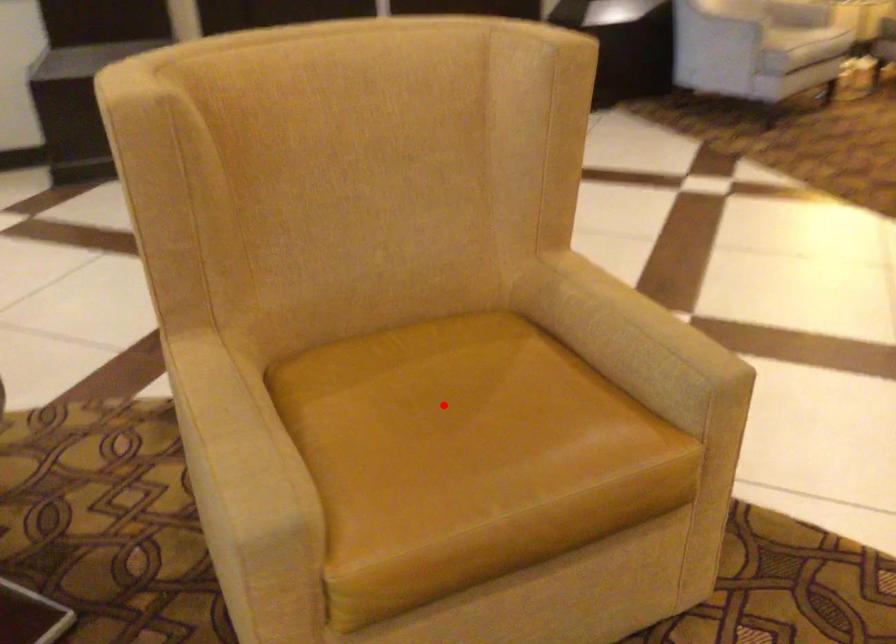
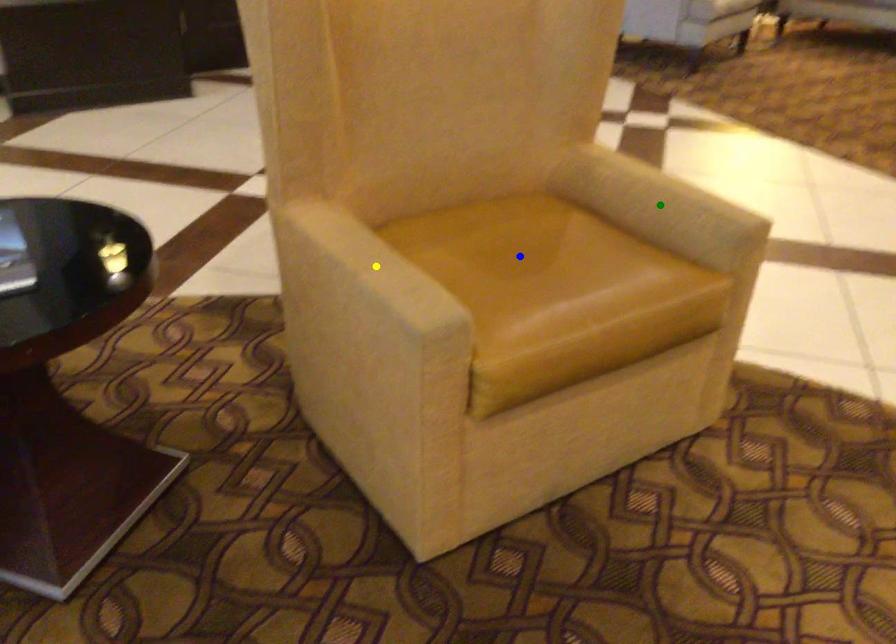
Question: I am providing you with two images of the same scene from different viewpoints. A red point is marked on the first image. You are given multiple points on the second image. In image 2, which mark is for the same physical point as the one in image 1?

Choices:
 (A) yellow point
 (B) green point
 (C) blue point

Answer: (C)